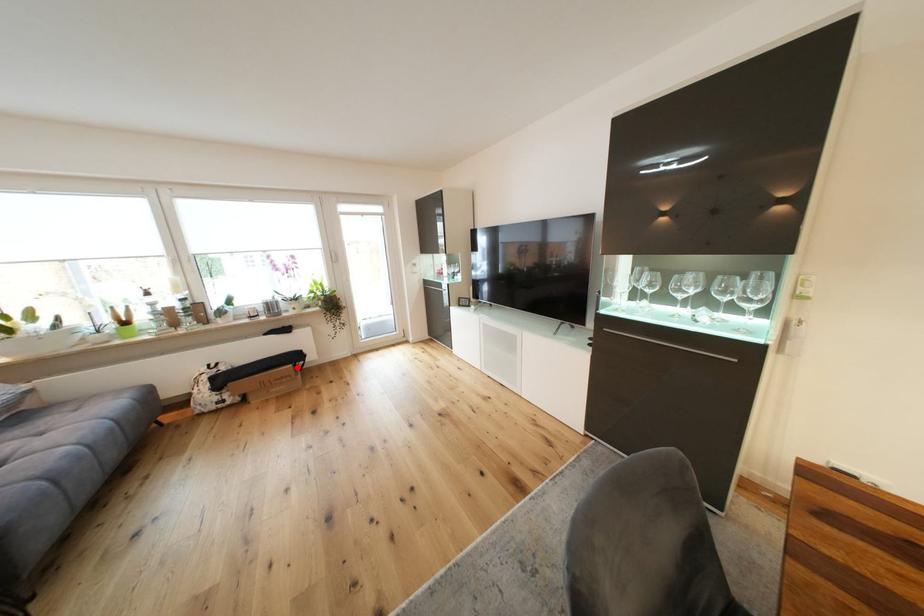
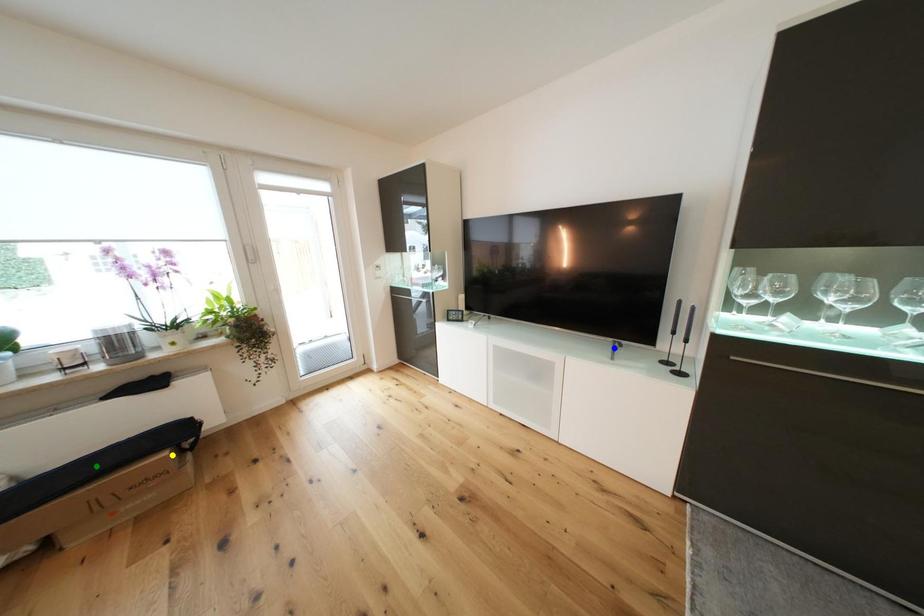
Question: I am providing you with two images of the same scene from different viewpoints. A red point is marked on the first image. You are given multiple points on the second image. Which spot in image 2 lines up with the point in image 1?

Choices:
 (A) yellow point
 (B) green point
 (C) blue point

Answer: (A)